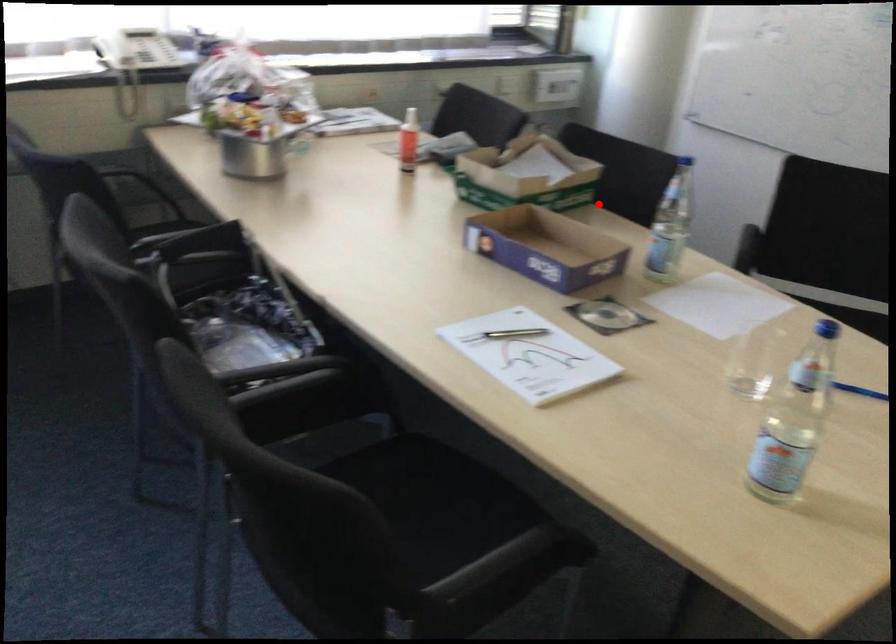
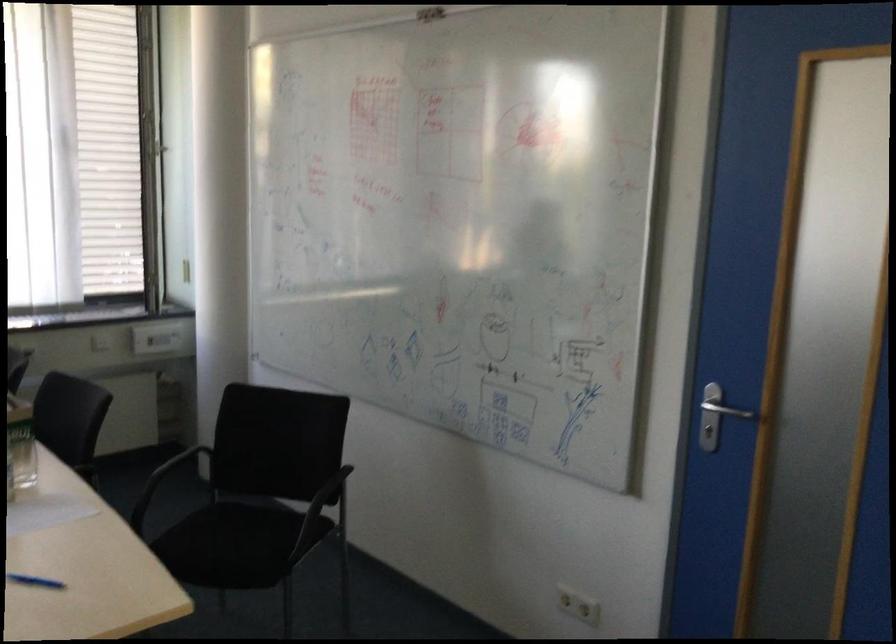
Locate, in the second image, the point that corresponds to the highlighted location in the first image.

(21, 444)